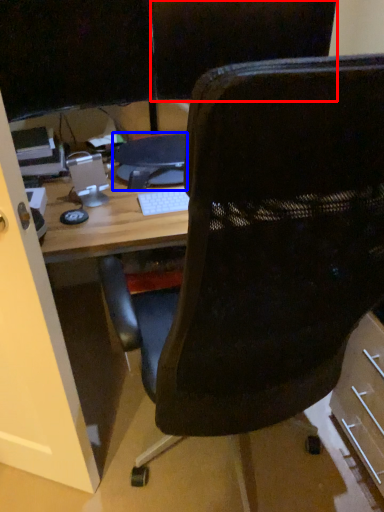
Question: Which of the following is the farthest to the observer, back (highlighted by a red box) or computer (highlighted by a blue box)?

Choices:
 (A) back
 (B) computer

Answer: (B)